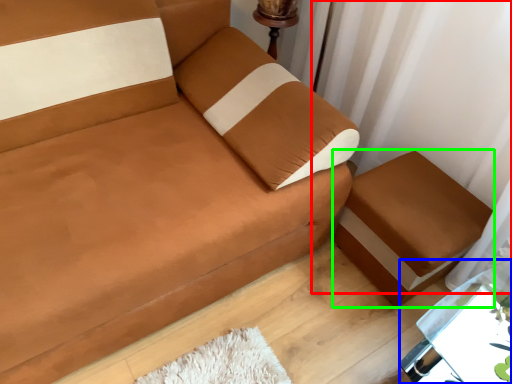
Question: Estimate the real-world distances between objects in this image. Which object is farther from curtain (highlighted by a red box), table (highlighted by a blue box) or furniture (highlighted by a green box)?

Choices:
 (A) table
 (B) furniture

Answer: (A)